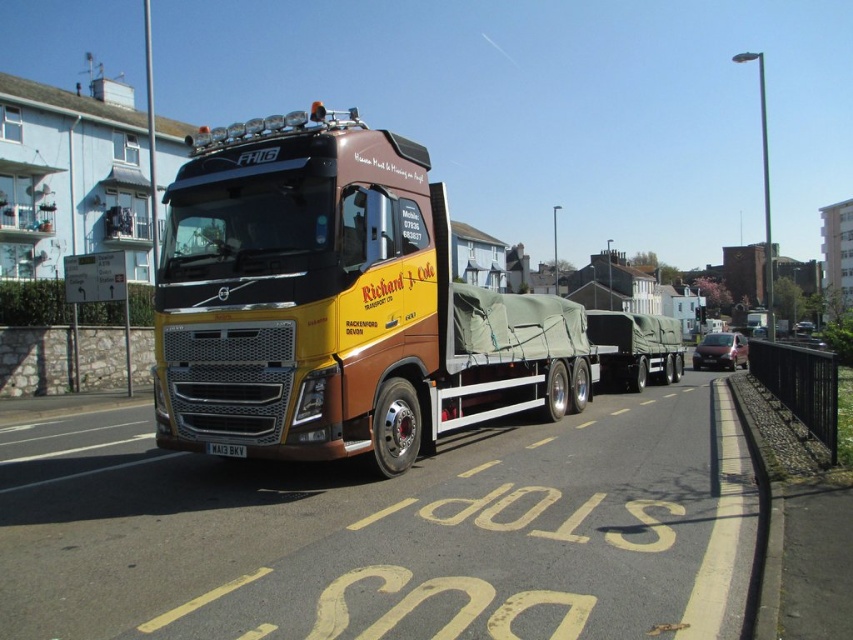
You are standing on the sidewalk and see the yellow metallic truck at center and the camouflage fabric trailer truck at center. Which one is closer to the left side of the road?

The yellow metallic truck at center is closer to the left side of the road because it is positioned to the left of the camouflage fabric trailer truck at center.

You are a delivery driver who needs to pass under a low bridge that has a height restriction of 4 meters. The yellow metallic truck at center and the camouflage fabric trailer truck at center are both part of your current vehicle. Which part of your vehicle should you be most concerned about exceeding the height limit?

The yellow metallic truck at center is taller than the camouflage fabric trailer truck at center, so you should be most concerned about the yellow metallic truck at center exceeding the height limit.

You are a delivery driver who needs to park the yellow metallic truck at center and the camouflage fabric trailer truck at center in a parking lot with limited space. Based on their sizes, which vehicle should be parked first to ensure both fit properly?

The yellow metallic truck at center is larger in size than the camouflage fabric trailer truck at center, so you should park the yellow metallic truck at center first to ensure there is enough space left for the smaller camouflage fabric trailer truck at center.